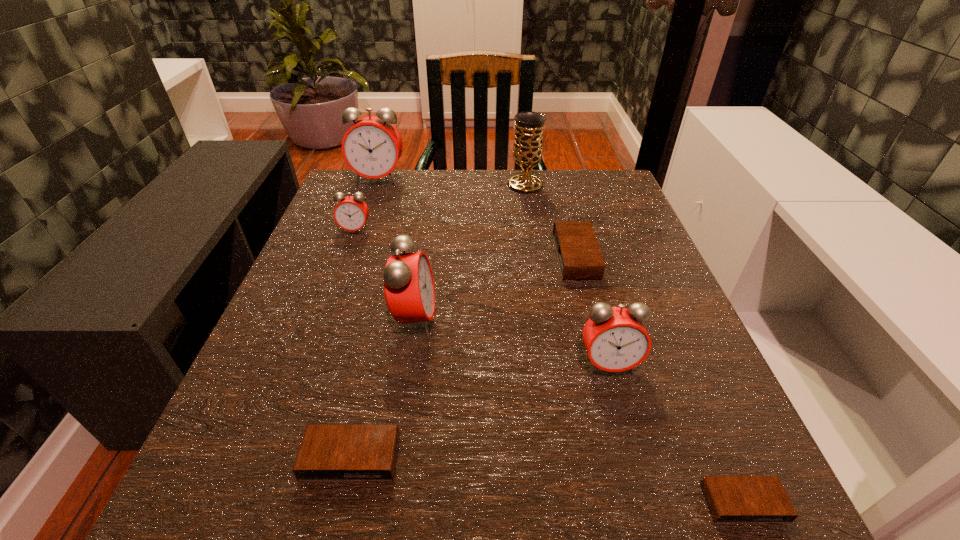
Locate an element on the screen. empty space between the chalice and the second nearest alarm clock is located at coordinates (438, 321).

Locate an element on the screen. The width and height of the screenshot is (960, 540). object that is the closest to the fourth tallest object is located at coordinates coord(731,499).

Locate an element on the screen. object that is the closest one to the third farthest red alarm clock is located at coordinates (327, 452).

You are a GUI agent. You are given a task and a screenshot of the screen. Output one action in this format:
    pyautogui.click(x=<x>, y=<y>)
    Task: Click on the alarm clock that is the third closest one to the fifth tallest alarm clock
    This screenshot has height=540, width=960.
    Given the screenshot: What is the action you would take?
    pyautogui.click(x=731, y=499)

Identify the location of the closest alarm clock to the sixth farthest object. The height and width of the screenshot is (540, 960). tap(731, 499).

Locate an element on the screen. red alarm clock that is the third closest to the fifth farthest alarm clock is located at coordinates (372, 147).

This screenshot has height=540, width=960. I want to click on red alarm clock that is the closest to the chalice, so click(x=372, y=147).

Locate which black alarm clock is the second closest to the chalice. Please provide its 2D coordinates. Your answer should be formatted as a tuple, i.e. [(x, y)], where the tuple contains the x and y coordinates of a point satisfying the conditions above.

[(327, 452)]

Find the location of a particular element. black alarm clock that is the second closest to the farthest red alarm clock is located at coordinates (327, 452).